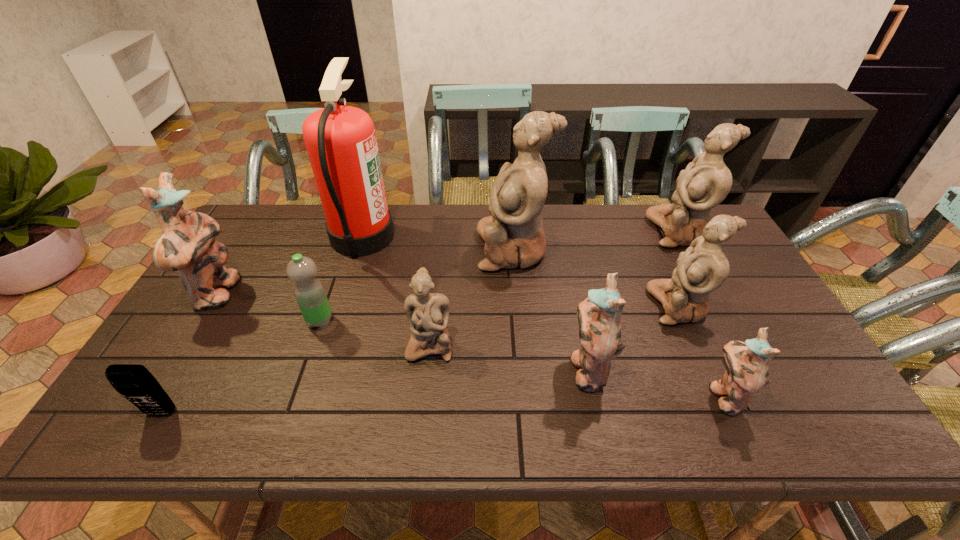
Identify the location of vacant point located between the second biggest white figurine and the nearest white figurine. Image resolution: width=960 pixels, height=540 pixels. (555, 288).

Where is `vacant space that is in between the third white figurine from right to left and the smallest white figurine`? vacant space that is in between the third white figurine from right to left and the smallest white figurine is located at coordinates (471, 297).

At what (x,y) coordinates should I click in order to perform the action: click on free area in between the green water bottle and the smallest pink figurine. Please return your answer as a coordinate pair (x, y). Image resolution: width=960 pixels, height=540 pixels. Looking at the image, I should click on (522, 359).

The width and height of the screenshot is (960, 540). I want to click on object that can be found as the second closest to the leftmost pink figurine, so click(309, 292).

Identify which object is the seventh closest to the sixth figurine from right to left. Please provide its 2D coordinates. Your answer should be formatted as a tuple, i.e. [(x, y)], where the tuple contains the x and y coordinates of a point satisfying the conditions above.

[(703, 267)]

Locate an element on the screen. figurine that stands as the closest to the second nearest white figurine is located at coordinates (747, 373).

Where is `the fifth closest figurine to the third farthest white figurine`? The width and height of the screenshot is (960, 540). the fifth closest figurine to the third farthest white figurine is located at coordinates (428, 313).

The width and height of the screenshot is (960, 540). Find the location of `the second closest white figurine to the nearest white figurine`. the second closest white figurine to the nearest white figurine is located at coordinates (703, 267).

Select which white figurine is the second closest to the rightmost pink figurine. Please provide its 2D coordinates. Your answer should be formatted as a tuple, i.e. [(x, y)], where the tuple contains the x and y coordinates of a point satisfying the conditions above.

[(514, 237)]

The image size is (960, 540). What are the coordinates of `pink figurine that can be found as the second closest to the smallest pink figurine` in the screenshot? It's located at (187, 244).